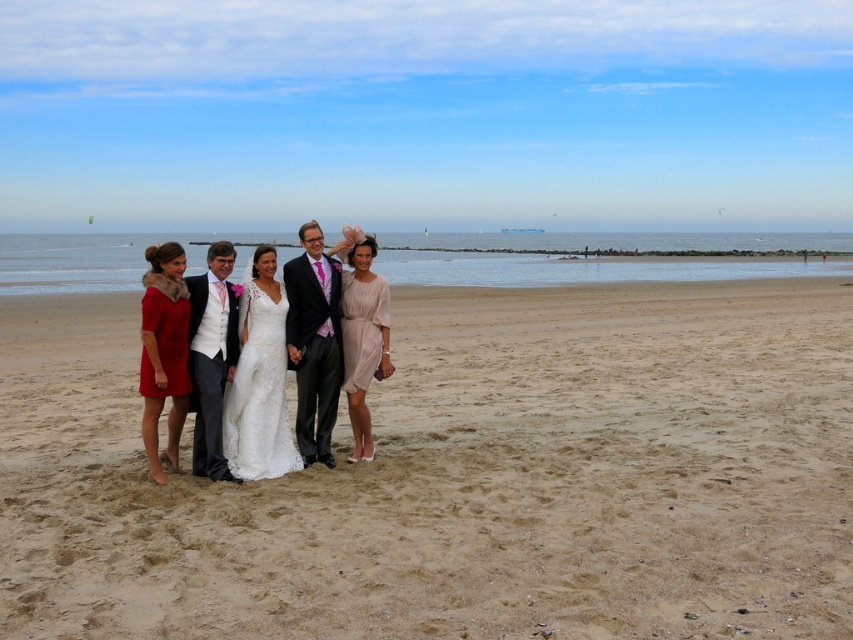
Is point (207, 452) behind point (155, 356)?

That is True.

Who is higher up, white satin dress at center or velvet red dress at left?

velvet red dress at left is above.

Is point (282, 424) behind point (155, 426)?

Yes, point (282, 424) is behind point (155, 426).

Find the location of `white satin dress at center`. white satin dress at center is located at coordinates (239, 371).

Is white satin dress at center to the left of matte gray suit at center from the viewer's perspective?

Yes, white satin dress at center is to the left of matte gray suit at center.

Does white satin dress at center have a smaller size compared to matte gray suit at center?

Actually, white satin dress at center might be larger than matte gray suit at center.

Who is more forward, (x=227, y=396) or (x=306, y=324)?

Positioned in front is point (x=227, y=396).

Identify the location of white satin dress at center. The height and width of the screenshot is (640, 853). (239, 371).

Between sandy beach at center and white satin dress at center, which one has more height?

sandy beach at center is taller.

Is sandy beach at center taller than white satin dress at center?

Indeed, sandy beach at center has a greater height compared to white satin dress at center.

Between point (791, 534) and point (241, 422), which one is positioned behind?

The point (241, 422) is more distant.

Image resolution: width=853 pixels, height=640 pixels. Identify the location of sandy beach at center. (457, 476).